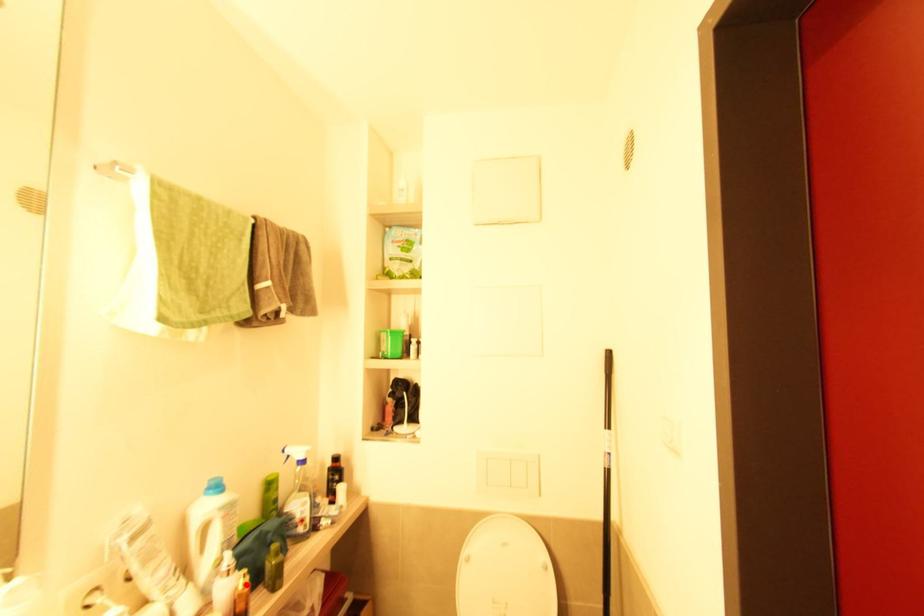
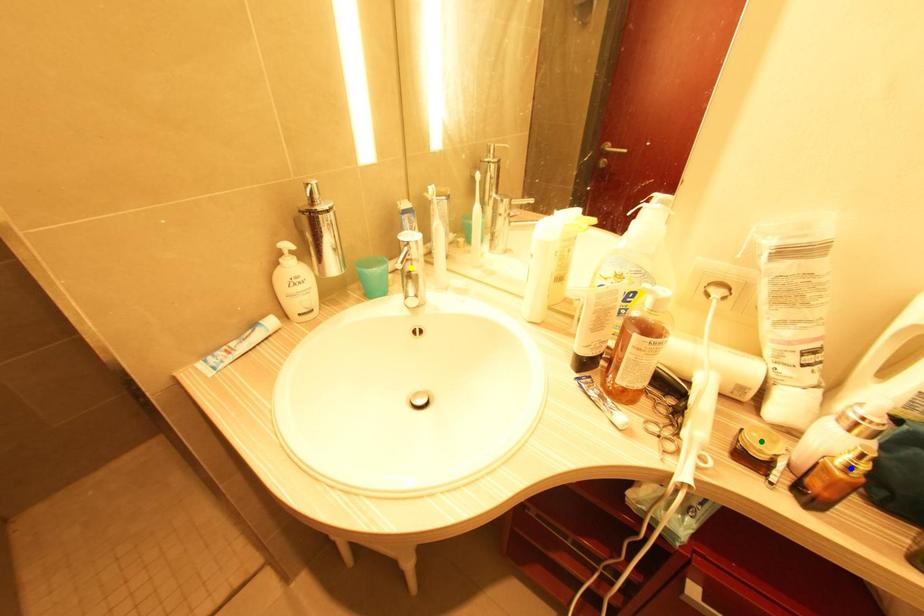
Question: I am providing you with two images of the same scene from different viewpoints. A red point is marked on the first image. You are given multiple points on the second image. Which mark in image 2 goes with the point in image 1?

Choices:
 (A) blue point
 (B) yellow point
 (C) green point

Answer: (A)